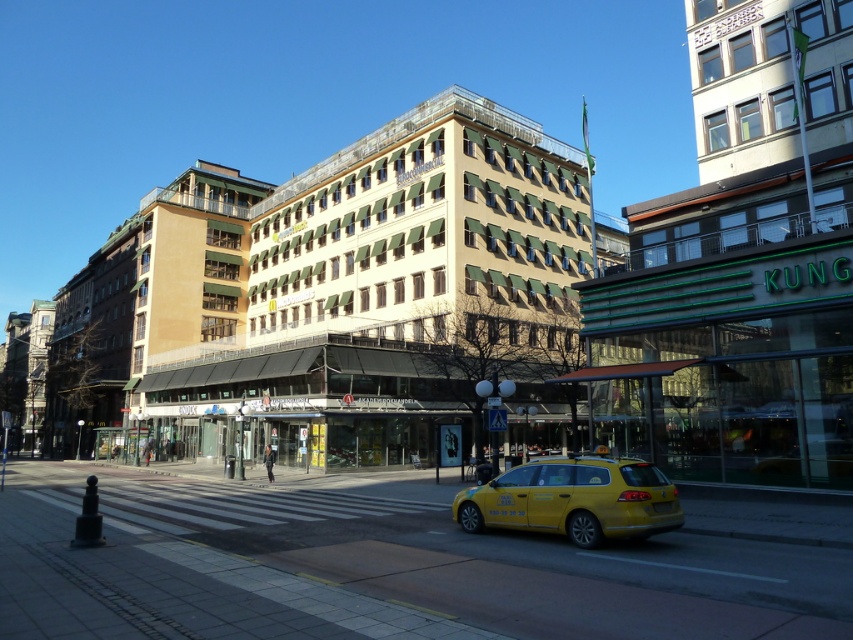
You are standing at the pedestrian crossing in front of the beige facade building with green awnings. You want to locate the point at coordinates (740,268). According to the scene description, where exactly is this point located?

The point at coordinates (740,268) is located on the white glass building at upper right.

You are standing at the pedestrian crossing in front of the building and want to take a photo of both the point at coordinates point(817, 182) and point(498, 492). Which point will appear closer to the edge of the photo frame?

Point(498, 492) will appear closer to the edge of the photo frame because it is closer to the camera than point(817, 182).